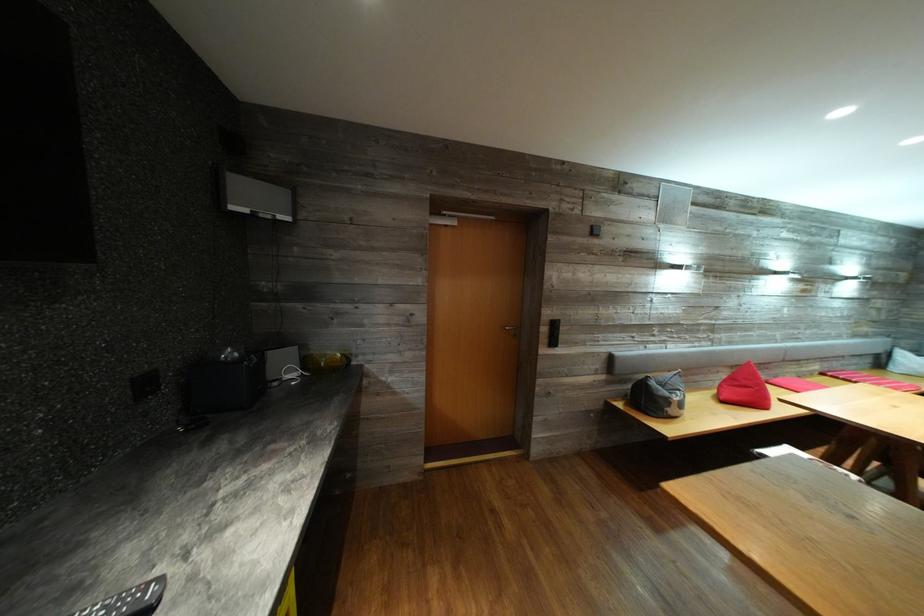
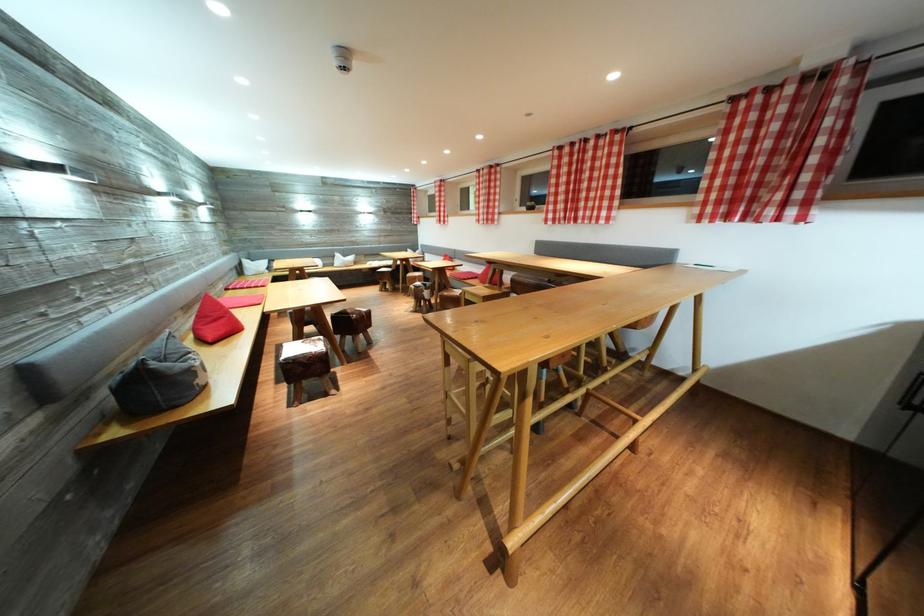
The point at (672, 399) is marked in the first image. Where is the corresponding point in the second image?

(187, 371)